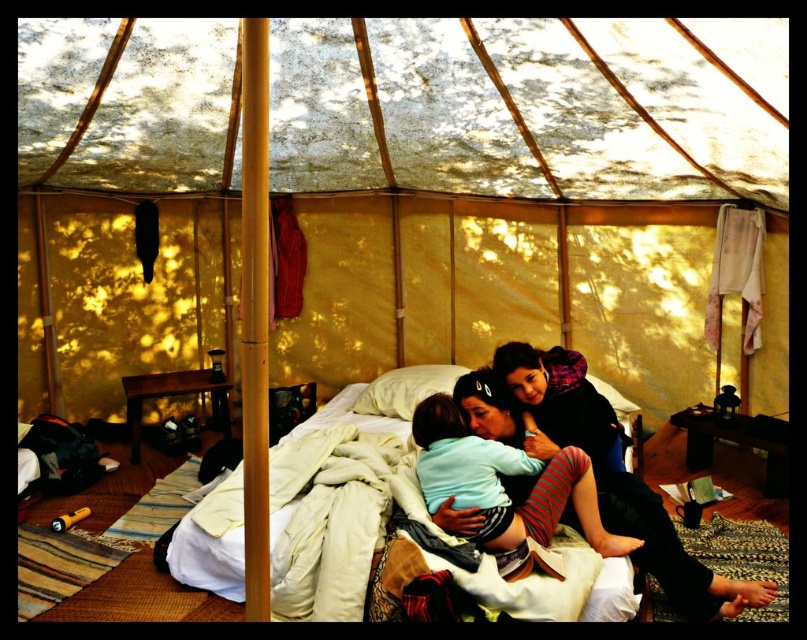
Question: Is transparent fabric canopy at upper center in front of white soft bed at center?

Choices:
 (A) yes
 (B) no

Answer: (A)

Question: Is white soft bed at center wider than light blue fabric at center?

Choices:
 (A) no
 (B) yes

Answer: (B)

Question: Which of the following is the farthest from the observer?

Choices:
 (A) (487, 497)
 (B) (399, 384)

Answer: (B)

Question: Can you confirm if transparent fabric canopy at upper center is positioned below white soft pillow at center?

Choices:
 (A) no
 (B) yes

Answer: (A)

Question: Which point is closer to the camera?

Choices:
 (A) white soft bed at center
 (B) light blue fabric at center
 (C) white soft pillow at center
 (D) transparent fabric canopy at upper center

Answer: (D)

Question: Considering the real-world distances, which object is closest to the matte black sweater at center?

Choices:
 (A) light blue fabric at center
 (B) transparent fabric canopy at upper center

Answer: (A)